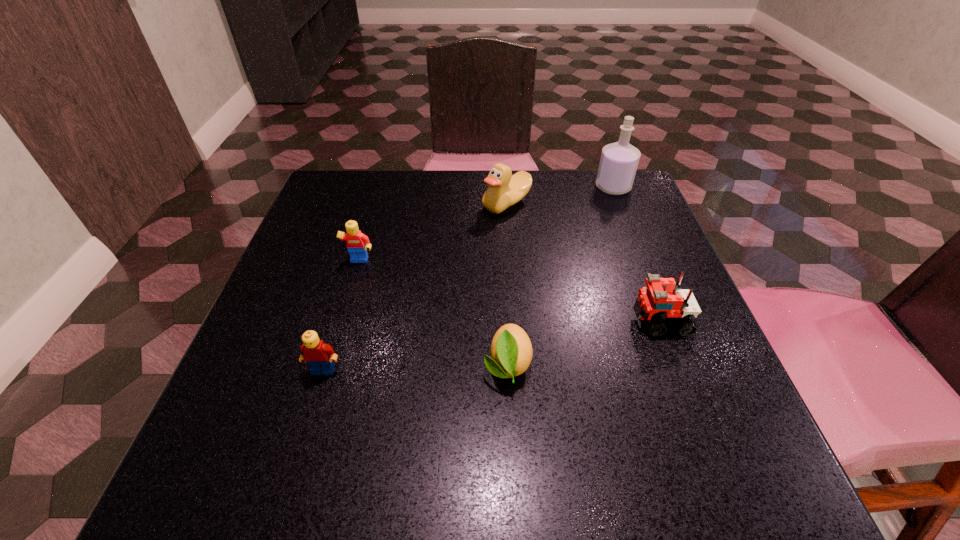
At what (x,y) coordinates should I click in order to perform the action: click on unoccupied position between the duck and the nearest Lego. Please return your answer as a coordinate pair (x, y). Looking at the image, I should click on (415, 287).

The width and height of the screenshot is (960, 540). I want to click on vacant point located between the rightmost Lego and the lemon, so click(584, 342).

In order to click on unoccupied position between the second farthest Lego and the farthest Lego in this screenshot , I will do `click(510, 291)`.

Identify the location of free space that is in between the duck and the nearest Lego. The image size is (960, 540). (415, 287).

This screenshot has height=540, width=960. I want to click on empty space that is in between the shortest object and the nearest Lego, so click(x=416, y=367).

Identify the location of the fourth closest object to the third farthest object. This screenshot has height=540, width=960. (656, 303).

Identify the location of the third closest object to the lemon. (357, 243).

This screenshot has height=540, width=960. Find the location of `Lego that is the second closest to the nearest Lego`. Lego that is the second closest to the nearest Lego is located at coordinates (656, 303).

Locate which Lego is the second closest to the third nearest object. Please provide its 2D coordinates. Your answer should be formatted as a tuple, i.e. [(x, y)], where the tuple contains the x and y coordinates of a point satisfying the conditions above.

[(319, 356)]

Locate an element on the screen. free space in the image that satisfies the following two spatial constraints: 1. at the beak of the duck; 2. on the front-facing side of the nearest Lego is located at coordinates (519, 370).